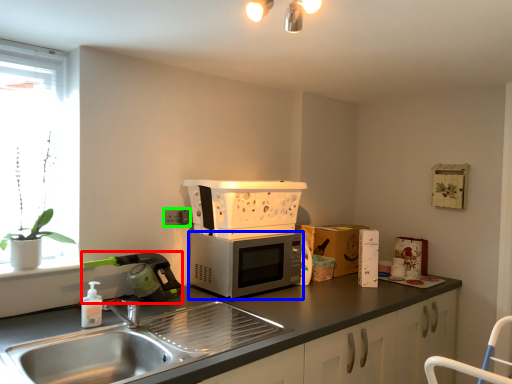
Question: Which is nearer to the appliance (highlighted by a red box)? microwave oven (highlighted by a blue box) or electric outlet (highlighted by a green box).

Choices:
 (A) microwave oven
 (B) electric outlet

Answer: (B)